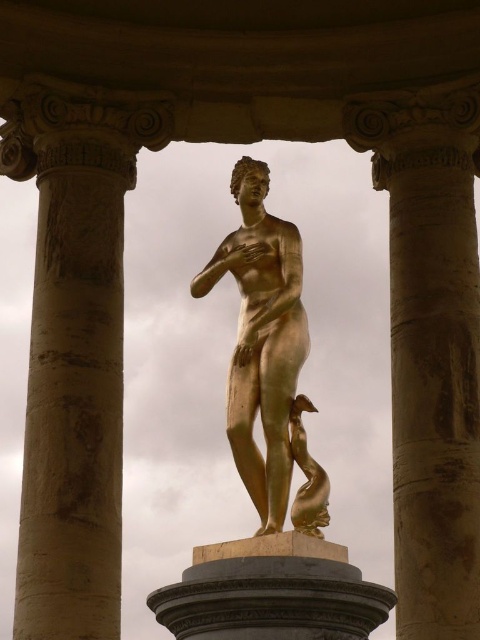
You are an architect designing a new museum exhibit and need to place a 10 meter wide sculpture between the golden polished stone column at center and the beige stone column at left. Is there enough space between them to fit the sculpture?

The golden polished stone column at center is 15.30 meters from the beige stone column at left, so yes, the 10 meter wide sculpture can fit between them since the distance between the two columns is greater than the sculpture width.

You are an art conservator assessing the stability of the golden polished stone column at center and the gold metallic statue at center. Which object is taller and therefore might require additional support to prevent toppling?

The golden polished stone column at center is taller than the gold metallic statue at center, so it might require additional support to prevent toppling.

You are an art restorer examining the statue from a close distance. You notice two points of damage on the statue. The first is at point (80,404) and the second at point (302,429). Which point is closer to you?

Point (80,404) is further to the viewer than point (302,429). Therefore, point (80,404) is closer to you.